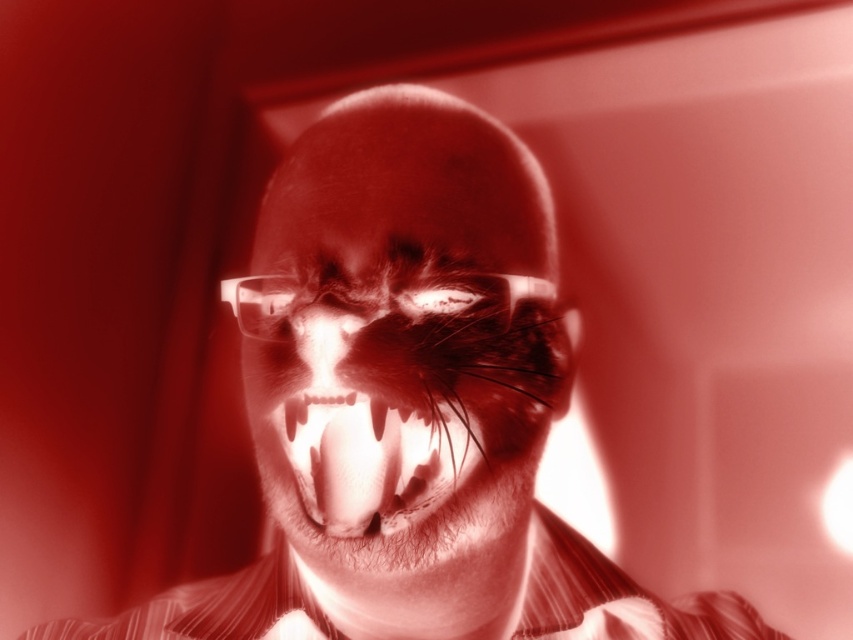
Which is in front, point (527, 300) or point (318, 336)?

Point (318, 336) is more forward.

Who is shorter, translucent plastic face at center or translucent glass nose at center?

Standing shorter between the two is translucent glass nose at center.

Does point (430, 189) come farther from viewer compared to point (300, 362)?

Yes.

Where is `translucent plastic face at center`? The width and height of the screenshot is (853, 640). translucent plastic face at center is located at coordinates (404, 340).

Between point (370, 372) and point (733, 608), which one is positioned in front?

Point (370, 372) is in front.

Can you confirm if translucent plastic face at center is taller than striped cotton dress shirt at center?

Yes.

Between point (259, 216) and point (560, 605), which one is positioned in front?

Point (259, 216)

I want to click on translucent plastic face at center, so click(x=404, y=340).

Who is positioned more to the right, translucent plastic face at center or translucent plastic mouth at center?

translucent plastic face at center

Is translucent plastic face at center to the left of translucent plastic mouth at center from the viewer's perspective?

No, translucent plastic face at center is not to the left of translucent plastic mouth at center.

Locate an element on the screen. translucent plastic face at center is located at coordinates (404, 340).

The image size is (853, 640). What are the coordinates of `translucent plastic face at center` in the screenshot? It's located at (404, 340).